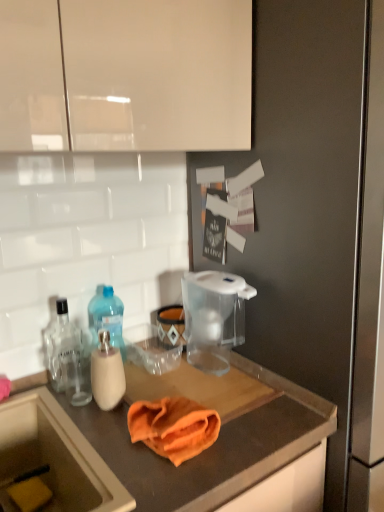
Identify the location of vacant area located to the right-hand side of translucent plastic bottle at left, which is the second bottle in left-to-right order. (172, 378).